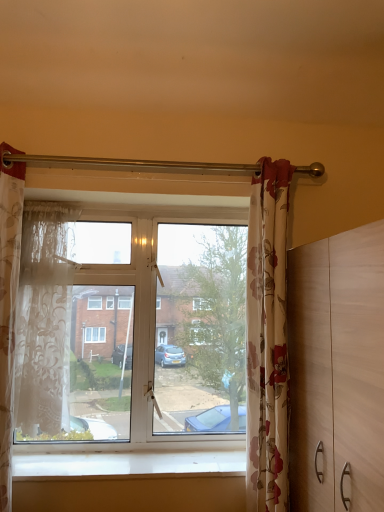
Question: Is translucent floral fabric curtain at left, the first curtain from the left, bigger than sheer white lace curtain at left, the 2th curtain from the right?

Choices:
 (A) yes
 (B) no

Answer: (A)

Question: Is translucent floral fabric curtain at left, the first curtain from the left, next to sheer white lace curtain at left, the second curtain when ordered from left to right?

Choices:
 (A) yes
 (B) no

Answer: (B)

Question: From a real-world perspective, does translucent floral fabric curtain at left, the first curtain from the left, sit lower than sheer white lace curtain at left, the 2th curtain from the right?

Choices:
 (A) no
 (B) yes

Answer: (B)

Question: From the image's perspective, is translucent floral fabric curtain at left, the 3th curtain viewed from the right, on top of sheer white lace curtain at left, the 2th curtain from the right?

Choices:
 (A) yes
 (B) no

Answer: (B)

Question: Does translucent floral fabric curtain at left, the 3th curtain viewed from the right, have a smaller size compared to sheer white lace curtain at left, the 2th curtain from the right?

Choices:
 (A) no
 (B) yes

Answer: (A)

Question: From a real-world perspective, is floral fabric curtain at right, which ranks as the third curtain in left-to-right order, positioned above or below translucent floral fabric curtain at left, the first curtain from the left?

Choices:
 (A) above
 (B) below

Answer: (B)

Question: Looking at their shapes, would you say floral fabric curtain at right, which is counted as the first curtain, starting from the right, is wider or thinner than translucent floral fabric curtain at left, the first curtain from the left?

Choices:
 (A) thin
 (B) wide

Answer: (A)

Question: Do you think floral fabric curtain at right, which is counted as the first curtain, starting from the right, is within translucent floral fabric curtain at left, the first curtain from the left, or outside of it?

Choices:
 (A) outside
 (B) inside

Answer: (A)

Question: Visually, is floral fabric curtain at right, which is counted as the first curtain, starting from the right, positioned to the left or to the right of translucent floral fabric curtain at left, the first curtain from the left?

Choices:
 (A) right
 (B) left

Answer: (A)

Question: Looking at their shapes, would you say sheer white lace curtain at left, the 2th curtain from the right, is wider or thinner than white smooth window sill at lower center?

Choices:
 (A) thin
 (B) wide

Answer: (A)

Question: From their relative heights in the image, would you say sheer white lace curtain at left, the second curtain when ordered from left to right, is taller or shorter than white smooth window sill at lower center?

Choices:
 (A) tall
 (B) short

Answer: (A)

Question: Which is correct: sheer white lace curtain at left, the 2th curtain from the right, is inside white smooth window sill at lower center, or outside of it?

Choices:
 (A) outside
 (B) inside

Answer: (A)

Question: From the image's perspective, is sheer white lace curtain at left, the second curtain when ordered from left to right, above or below white smooth window sill at lower center?

Choices:
 (A) above
 (B) below

Answer: (A)

Question: Considering their positions, is floral fabric curtain at right, which is counted as the first curtain, starting from the right, located in front of or behind light brown wooden dresser at right?

Choices:
 (A) front
 (B) behind

Answer: (B)

Question: From the image's perspective, is floral fabric curtain at right, which is counted as the first curtain, starting from the right, located above or below light brown wooden dresser at right?

Choices:
 (A) below
 (B) above

Answer: (B)